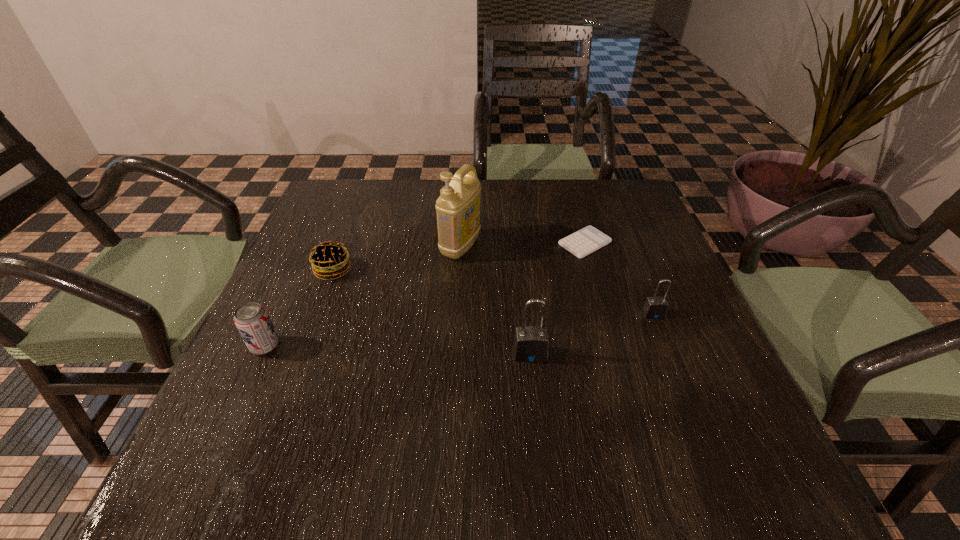
The height and width of the screenshot is (540, 960). I want to click on calculator, so click(587, 240).

Locate an element on the screen. The width and height of the screenshot is (960, 540). vacant point located on the shackle of the nearer padlock is located at coordinates (538, 426).

You are a GUI agent. You are given a task and a screenshot of the screen. Output one action in this format:
    pyautogui.click(x=<x>, y=<y>)
    Task: Click on the vacant space located on the shackle of the farther padlock
    This screenshot has width=960, height=540.
    Given the screenshot: What is the action you would take?
    pyautogui.click(x=693, y=414)

Locate an element on the screen. Image resolution: width=960 pixels, height=540 pixels. vacant space situated 0.140m on the back of the second shortest object is located at coordinates (350, 225).

The width and height of the screenshot is (960, 540). I want to click on free location located on the right of the fourth object from right to left, so click(x=625, y=247).

I want to click on vacant space positioned on the right of the leftmost object, so click(320, 346).

Locate an element on the screen. This screenshot has width=960, height=540. free space located on the left of the second object from right to left is located at coordinates (420, 243).

This screenshot has height=540, width=960. I want to click on patty that is at the left edge, so click(x=329, y=259).

What are the coordinates of `beer can positioned at the left edge` in the screenshot? It's located at (251, 319).

This screenshot has width=960, height=540. I want to click on padlock that is at the right edge, so click(655, 307).